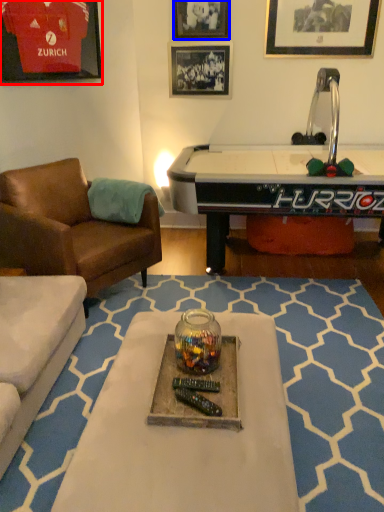
Question: Which object is further to the camera taking this photo, picture frame (highlighted by a red box) or picture frame (highlighted by a blue box)?

Choices:
 (A) picture frame
 (B) picture frame

Answer: (B)